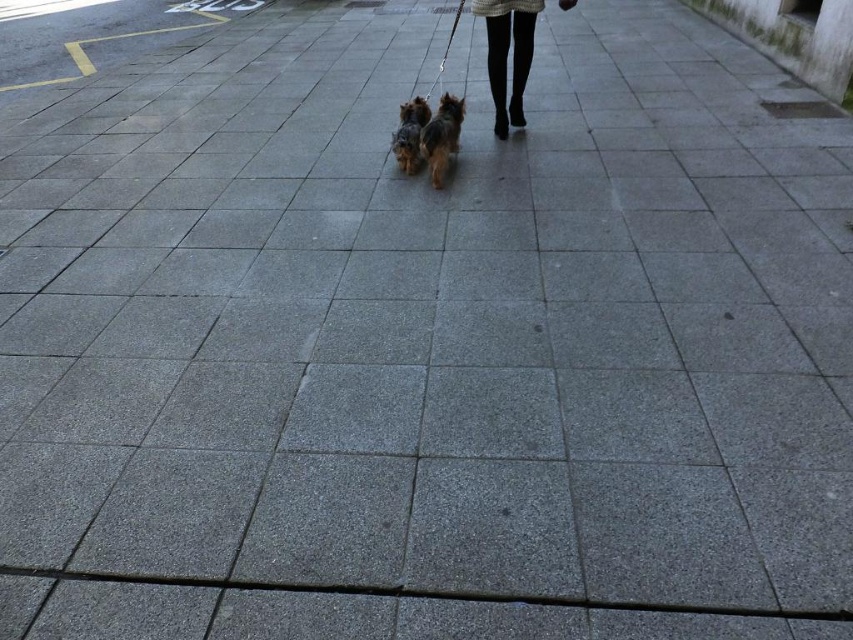
Is point (450, 156) positioned after point (421, 100)?

No, it is in front of (421, 100).

Who is more forward, (426, 154) or (410, 128)?

Point (426, 154) is more forward.

Locate an element on the screen. The height and width of the screenshot is (640, 853). short-haired brown dog at center is located at coordinates click(440, 138).

How distant is black tights at center from short-haired brown dog at center?

20.10 inches

Can you confirm if black tights at center is wider than short-haired brown dog at center?

Yes.

Between point (521, 72) and point (428, 140), which one is positioned in front?

Point (428, 140)

The height and width of the screenshot is (640, 853). I want to click on black tights at center, so (506, 54).

From the picture: Is black tights at center to the left of shaggy brown dog at center from the viewer's perspective?

Incorrect, black tights at center is not on the left side of shaggy brown dog at center.

This screenshot has height=640, width=853. Find the location of `black tights at center`. black tights at center is located at coordinates (506, 54).

Find the location of a particular element. black tights at center is located at coordinates (506, 54).